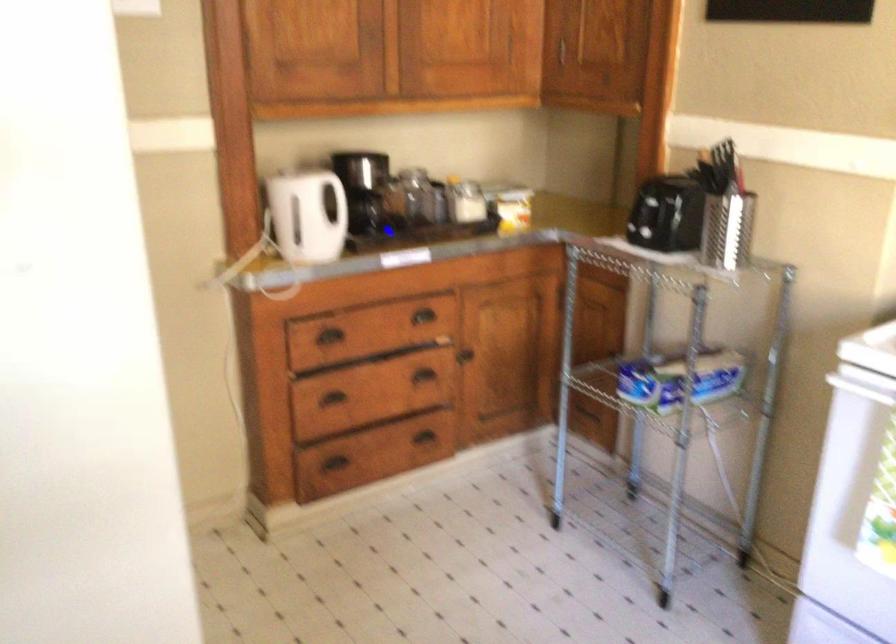
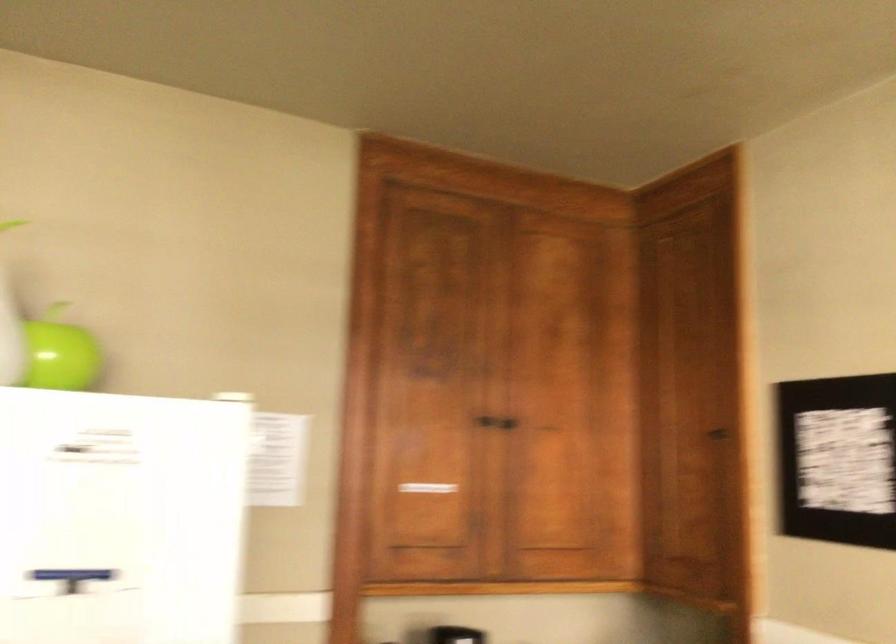
Question: How did the camera likely rotate?

Choices:
 (A) Left
 (B) Right
 (C) Up
 (D) Down

Answer: (C)